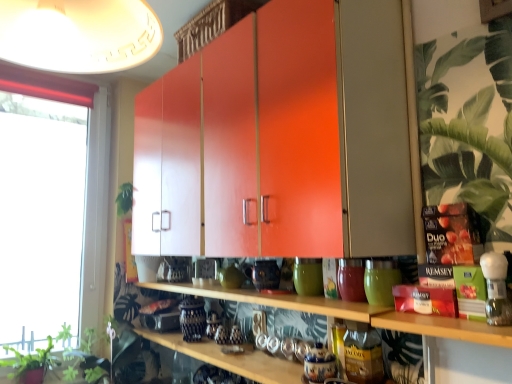
In order to face green matte glass at center, acting as the 3th pottery starting from the back, should I rotate leftwards or rightwards?

A 15.581 degree turn to the right will do.

This screenshot has height=384, width=512. What do you see at coordinates (380, 281) in the screenshot?
I see `green matte glass at center, acting as the 3th pottery starting from the back` at bounding box center [380, 281].

Where is `green matte plant at lower left, which appears as the 2th plant when viewed from the left`? green matte plant at lower left, which appears as the 2th plant when viewed from the left is located at coordinates (108, 359).

Consider the image. What is the approximate height of wooden shelf at center, arranged as the first shelf when viewed from the top?

wooden shelf at center, arranged as the first shelf when viewed from the top, is 4.03 centimeters in height.

In order to click on matte ceramic jar at center, the second pottery in the left-to-right sequence in this screenshot , I will do `click(351, 280)`.

This screenshot has height=384, width=512. In order to click on matte white lampshade at upper left in this screenshot , I will do `click(79, 34)`.

Which object is positioned more to the left, wooden shelf at center, positioned as the 2th shelf in top-to-bottom order, or transparent glass window at left?

From the viewer's perspective, transparent glass window at left appears more on the left side.

Is wooden shelf at center, positioned as the 2th shelf in top-to-bottom order, oriented away from transparent glass window at left?

wooden shelf at center, positioned as the 2th shelf in top-to-bottom order, is not turned away from transparent glass window at left.

Can you tell me how much wooden shelf at center, positioned as the 2th shelf in top-to-bottom order, and transparent glass window at left differ in facing direction?

There is a 89.6-degree angle between the facing directions of wooden shelf at center, positioned as the 2th shelf in top-to-bottom order, and transparent glass window at left.

Relative to transparent glass window at left, is wooden shelf at center, the first shelf from the bottom, in front or behind?

wooden shelf at center, the first shelf from the bottom, is in front of transparent glass window at left.

Who is shorter, wooden shelf at center, arranged as the first shelf when viewed from the top, or matte orange cabinet at center?

wooden shelf at center, arranged as the first shelf when viewed from the top, is shorter.

Is wooden shelf at center, arranged as the first shelf when viewed from the top, wider than matte orange cabinet at center?

In fact, wooden shelf at center, arranged as the first shelf when viewed from the top, might be narrower than matte orange cabinet at center.

Is wooden shelf at center, the 2th shelf ordered from the bottom, beside matte orange cabinet at center?

wooden shelf at center, the 2th shelf ordered from the bottom, and matte orange cabinet at center are not in contact.

Which of these two, green matte vase at center, which is counted as the first pottery, starting from the back, or green matte plant at lower left, which appears as the 2th plant when viewed from the left, is thinner?

green matte vase at center, which is counted as the first pottery, starting from the back, is thinner.

From the image's perspective, who appears lower, green matte vase at center, the 3th pottery from the right, or green matte plant at lower left, the first plant viewed from the back?

From the image's view, green matte plant at lower left, the first plant viewed from the back, is below.

In the scene shown: Considering the relative sizes of green matte vase at center, marked as the 3th pottery in a front-to-back arrangement, and green matte plant at lower left, which is the 2th plant from bottom to top, in the image provided, is green matte vase at center, marked as the 3th pottery in a front-to-back arrangement, bigger than green matte plant at lower left, which is the 2th plant from bottom to top,?

No.

Who is bigger, matte white lampshade at upper left or green matte vase at center, marked as the 3th pottery in a front-to-back arrangement?

matte white lampshade at upper left.

Which object is closer to the camera, matte white lampshade at upper left or green matte vase at center, the 3th pottery from the right?

matte white lampshade at upper left.

Could you tell me if matte white lampshade at upper left is facing green matte vase at center, which is counted as the first pottery, starting from the back?

No.

Is green leafy plant at upper right, which is the third plant from left to right, taller than green matte vase at center, marked as the 3th pottery in a front-to-back arrangement?

Yes.

Is green leafy plant at upper right, the 1th plant viewed from the top, outside of green matte vase at center, which ranks as the first pottery in left-to-right order?

Yes, green leafy plant at upper right, the 1th plant viewed from the top, is located beyond the bounds of green matte vase at center, which ranks as the first pottery in left-to-right order.

Can you tell me how much green leafy plant at upper right, positioned as the third plant in bottom-to-top order, and green matte vase at center, the 3th pottery from the right, differ in facing direction?

The facing directions of green leafy plant at upper right, positioned as the third plant in bottom-to-top order, and green matte vase at center, the 3th pottery from the right, are 1.05 degrees apart.

Which is less distant, (423, 77) or (317, 264)?

Point (423, 77).

Would you say green matte glass at center, the 1th pottery viewed from the right, is outside green leafy plant at upper right, marked as the first plant in a front-to-back arrangement?

Yes, green matte glass at center, the 1th pottery viewed from the right, is not within green leafy plant at upper right, marked as the first plant in a front-to-back arrangement.

Is green matte glass at center, acting as the 3th pottery starting from the back, closer to the viewer compared to green leafy plant at upper right, marked as the first plant in a right-to-left arrangement?

No.

From the image's perspective, between green matte glass at center, the 1th pottery viewed from the right, and green leafy plant at upper right, marked as the first plant in a front-to-back arrangement, which one is located above?

From the image's view, green leafy plant at upper right, marked as the first plant in a front-to-back arrangement, is above.

Considering the positions of objects green matte glass at center, which appears as the 1th pottery when viewed from the front, and green leafy plant at upper right, marked as the first plant in a right-to-left arrangement, in the image provided, who is more to the right, green matte glass at center, which appears as the 1th pottery when viewed from the front, or green leafy plant at upper right, marked as the first plant in a right-to-left arrangement,?

From the viewer's perspective, green leafy plant at upper right, marked as the first plant in a right-to-left arrangement, appears more on the right side.

Is wooden shelf at center, the 2th shelf ordered from the bottom, positioned beyond the bounds of green leafy plant at lower left, the second plant when ordered from front to back?

Yes.

Considering the sizes of objects wooden shelf at center, the 2th shelf ordered from the bottom, and green leafy plant at lower left, the second plant when ordered from front to back, in the image provided, who is taller, wooden shelf at center, the 2th shelf ordered from the bottom, or green leafy plant at lower left, the second plant when ordered from front to back,?

green leafy plant at lower left, the second plant when ordered from front to back.

From the image's perspective, which object appears higher, wooden shelf at center, arranged as the first shelf when viewed from the top, or green leafy plant at lower left, which ranks as the 1th plant in left-to-right order?

wooden shelf at center, arranged as the first shelf when viewed from the top, appears higher in the image.

You are a GUI agent. You are given a task and a screenshot of the screen. Output one action in this format:
    pyautogui.click(x=<x>, y=<y>)
    Task: Click on the shelf that is the 2nd one when counting downward from the transparent glass window at left (from the image's perspective)
    The image size is (512, 384).
    Given the screenshot: What is the action you would take?
    pyautogui.click(x=282, y=301)

The image size is (512, 384). In order to click on the 2nd shelf behind the matte orange cabinet at center in this screenshot , I will do `click(279, 300)`.

Considering their positions, is matte white lampshade at upper left positioned closer to matte orange cabinet at center than transparent glass window at left?

matte white lampshade at upper left lies closer to matte orange cabinet at center than the other object.

Looking at the image, which one is located further to matte orange cabinet at center, matte ceramic jar at center, which ranks as the second pottery in right-to-left order, or green matte vase at center, which ranks as the first pottery in left-to-right order?

Based on the image, matte ceramic jar at center, which ranks as the second pottery in right-to-left order, appears to be further to matte orange cabinet at center.

Which object lies nearer to the anchor point green leafy plant at lower left, acting as the 3th plant starting from the top, matte ceramic jar at center, acting as the 2th pottery starting from the front, or transparent glass window at left?

Among the two, transparent glass window at left is located nearer to green leafy plant at lower left, acting as the 3th plant starting from the top.

From the image, which object appears to be nearer to green matte glass at center, the 1th pottery viewed from the right, matte ceramic jar at center, the second pottery in the left-to-right sequence, or transparent glass window at left?

The object closer to green matte glass at center, the 1th pottery viewed from the right, is matte ceramic jar at center, the second pottery in the left-to-right sequence.

Considering their positions, is green matte vase at center, the 3th pottery from the right, positioned further to matte ceramic jar at center, the second pottery in the left-to-right sequence, than wooden shelf at center, arranged as the first shelf when viewed from the top?

wooden shelf at center, arranged as the first shelf when viewed from the top.

Based on their spatial positions, is transparent glass window at left or wooden shelf at center, the 2th shelf ordered from the bottom, further from green leafy plant at upper right, which is the third plant from left to right?

The object further to green leafy plant at upper right, which is the third plant from left to right, is transparent glass window at left.

Estimate the real-world distances between objects in this image. Which object is closer to transparent glass window at left, wooden shelf at center, the first shelf from the bottom, or matte ceramic jar at center, acting as the 2th pottery starting from the front?

wooden shelf at center, the first shelf from the bottom.

Which object lies nearer to the anchor point green matte plant at lower left, which appears as the 2th plant when viewed from the right, transparent glass window at left or wooden shelf at center, arranged as the first shelf when viewed from the top?

wooden shelf at center, arranged as the first shelf when viewed from the top, is closer to green matte plant at lower left, which appears as the 2th plant when viewed from the right.

Image resolution: width=512 pixels, height=384 pixels. Identify the location of plant between green leafy plant at lower left, acting as the 3th plant starting from the top, and green leafy plant at upper right, the 3th plant in the back-to-front sequence, in the horizontal direction. (108, 359).

I want to click on lamp between transparent glass window at left and matte ceramic jar at center, acting as the 2th pottery starting from the front, from left to right, so click(x=79, y=34).

I want to click on lamp between green matte plant at lower left, which is the 2th plant from bottom to top, and green leafy plant at upper right, marked as the first plant in a front-to-back arrangement, from left to right, so click(79, 34).

Find the location of a particular element. lamp between green leafy plant at lower left, the second plant when ordered from front to back, and green leafy plant at upper right, the 1th plant viewed from the top is located at coordinates (79, 34).